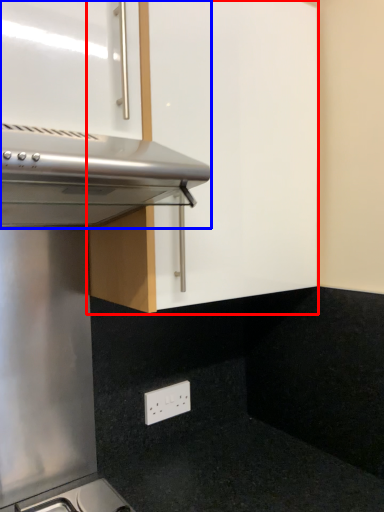
Question: Which of the following is the closest to the observer, cabinetry (highlighted by a red box) or oven (highlighted by a blue box)?

Choices:
 (A) cabinetry
 (B) oven

Answer: (B)